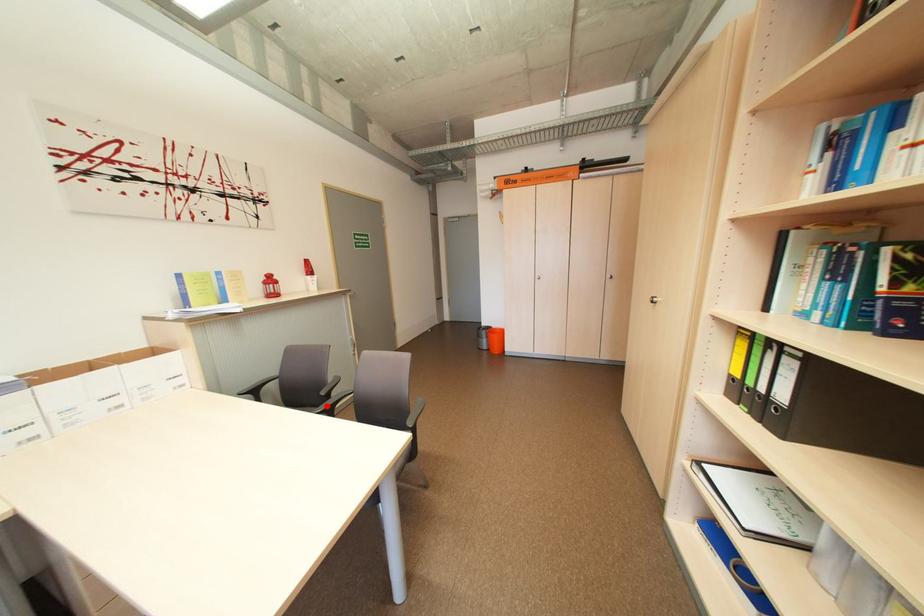
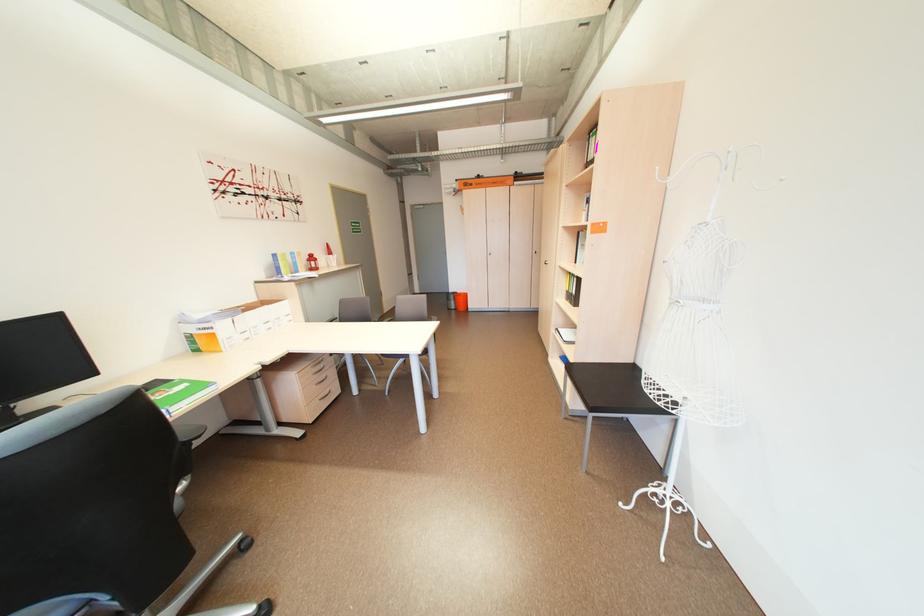
Question: I am providing you with two images of the same scene from different viewpoints. A red point is marked on the first image. Is the red point's position out of view in image 2?

Choices:
 (A) Yes
 (B) No

Answer: (A)